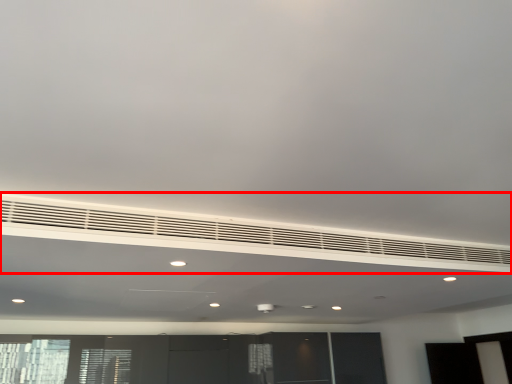
Question: In this image, where is air conditioning (annotated by the red box) located relative to entertainment center?

Choices:
 (A) right
 (B) left

Answer: (A)